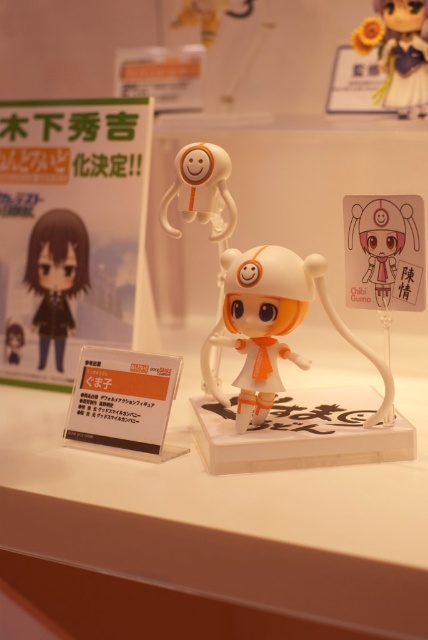
Question: Based on their relative distances, which object is farther from the white glossy doll at center?

Choices:
 (A) matte white plush at center
 (B) matte white figurine at upper right

Answer: (B)

Question: Which point is farther to the camera?

Choices:
 (A) matte white figurine at upper right
 (B) white glossy doll at center

Answer: (A)

Question: Which object is closer to the camera taking this photo?

Choices:
 (A) white glossy doll at center
 (B) matte white plush at center
 (C) matte white figurine at upper right
 (D) white plastic ledge at center

Answer: (D)

Question: Can you confirm if matte black figure at center is positioned below matte white figurine at upper right?

Choices:
 (A) yes
 (B) no

Answer: (A)

Question: Observing the image, what is the correct spatial positioning of white plastic ledge at center in reference to white glossy doll at center?

Choices:
 (A) left
 (B) right

Answer: (A)

Question: Is white plastic ledge at center closer to the viewer compared to matte black figure at center?

Choices:
 (A) no
 (B) yes

Answer: (B)